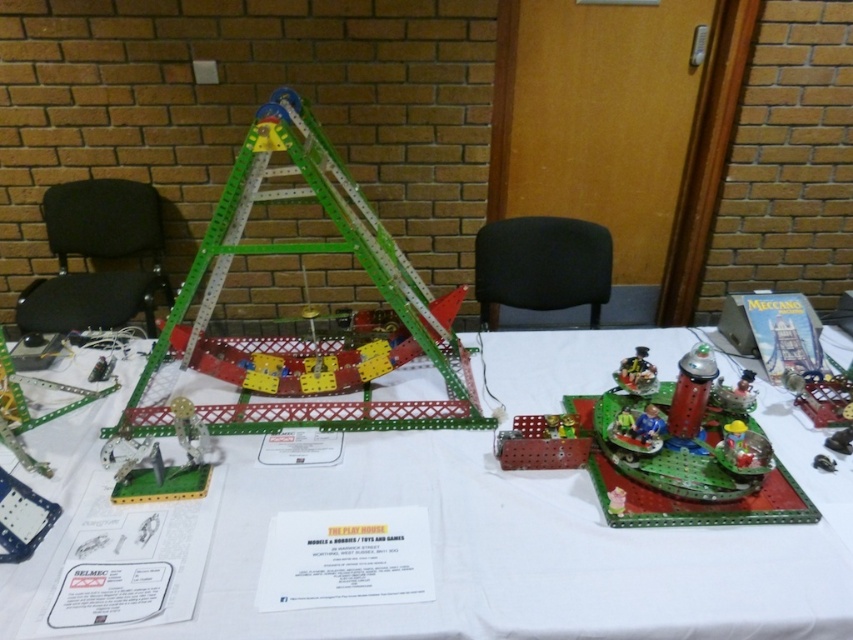
You are organizing a Meccano workshop and need to move a participant from the black fabric chair at left to the metallic green tower at center. Which direction should they move to reach the tower?

The participant should move to the right since the black fabric chair at left is positioned on the left side of the metallic green tower at center.

You are standing in front of the table with Meccano models and components. There is a point at coordinates point (119, 324). Can you determine how far this point is from your current position?

The distance of point (119, 324) from camera is 7.73 feet.

You are a guest at a family gathering and want to sit down. You see the black fabric chair at left and the metallic green tower at center. Which one is wider?

The black fabric chair at left is wider than the metallic green tower at center.